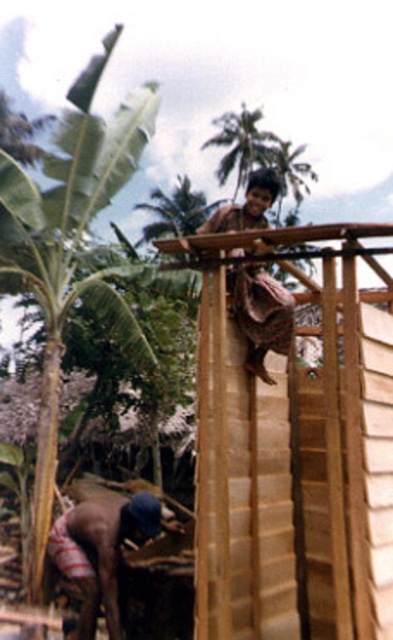
At what (x,y) coordinates should I click in order to perform the action: click on brown striped shorts at lower left. Please return your answer as a coordinate pair (x, y). The height and width of the screenshot is (640, 393). Looking at the image, I should click on (101, 552).

Where is `brown striped shorts at lower left`? Image resolution: width=393 pixels, height=640 pixels. brown striped shorts at lower left is located at coordinates (101, 552).

Between green leafy banana tree at left and brown woven cloth at upper center, which one is positioned lower?

Positioned lower is green leafy banana tree at left.

Looking at this image, which is more to the left, green leafy banana tree at left or brown woven cloth at upper center?

green leafy banana tree at left

What do you see at coordinates (71, 250) in the screenshot? I see `green leafy banana tree at left` at bounding box center [71, 250].

Where is `green leafy banana tree at left`? Image resolution: width=393 pixels, height=640 pixels. green leafy banana tree at left is located at coordinates (71, 250).

Does green leafy banana tree at left appear over brown striped shorts at lower left?

Indeed, green leafy banana tree at left is positioned over brown striped shorts at lower left.

Which is behind, point (18, 204) or point (141, 522)?

The point (18, 204) is behind.

Is point (7, 170) less distant than point (108, 596)?

That is False.

What are the coordinates of `green leafy banana tree at left` in the screenshot? It's located at (71, 250).